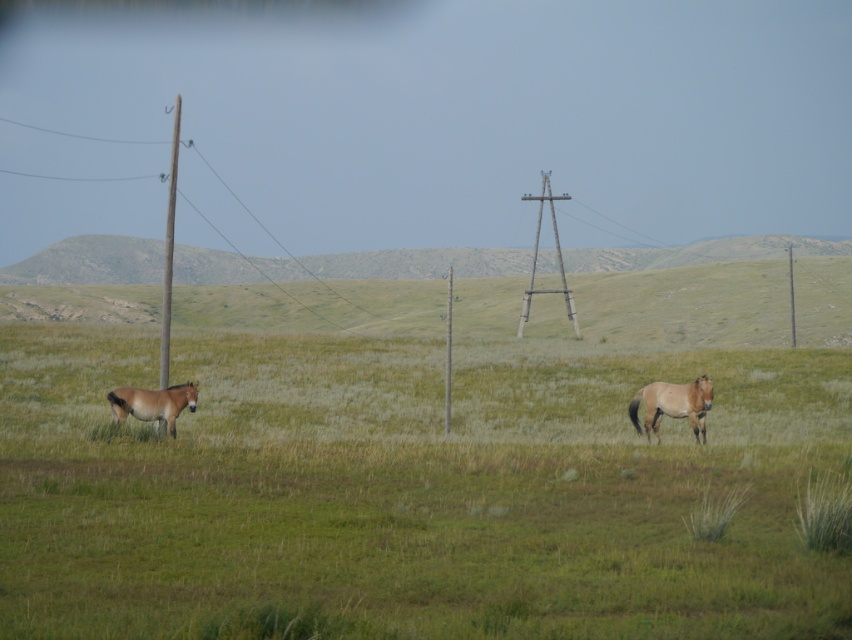
Question: Which object is farther from the camera taking this photo?

Choices:
 (A) brown matte horse at right
 (B) brown wooden telegraph pole at left
 (C) metallic gray telegraph pole at center
 (D) brown glossy horse at left

Answer: (C)

Question: Is brown wooden telegraph pole at left bigger than smooth wood telegraph pole at right?

Choices:
 (A) no
 (B) yes

Answer: (B)

Question: Which point is closer to the camera?

Choices:
 (A) (147, 419)
 (B) (447, 429)

Answer: (A)

Question: Can you confirm if brown wooden telegraph pole at left is thinner than smooth wood telegraph pole at right?

Choices:
 (A) no
 (B) yes

Answer: (A)

Question: From the image, what is the correct spatial relationship of brown matte horse at right in relation to metallic gray telegraph pole at center?

Choices:
 (A) right
 (B) left

Answer: (B)

Question: Which point is closer to the camera taking this photo?

Choices:
 (A) (705, 401)
 (B) (176, 397)
 (C) (164, 346)

Answer: (A)